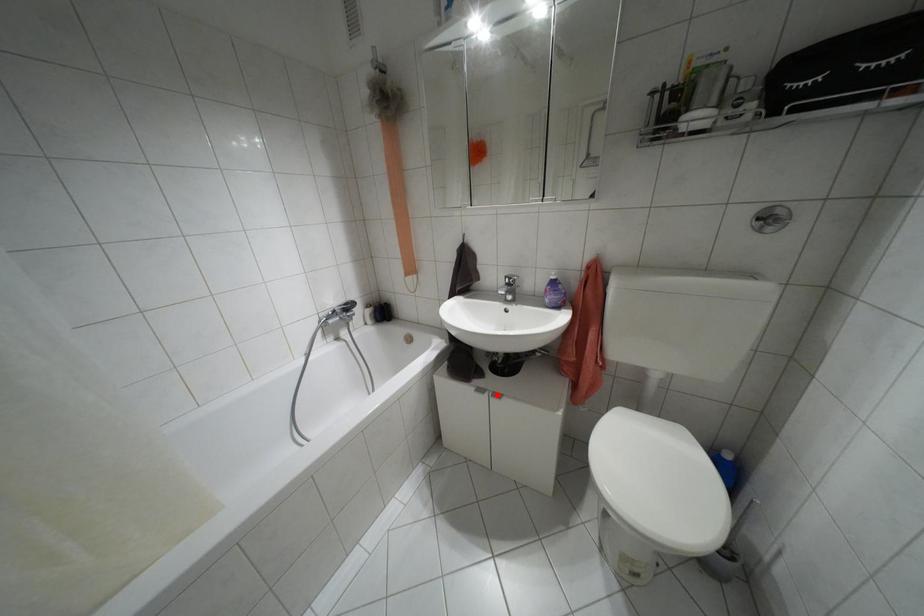
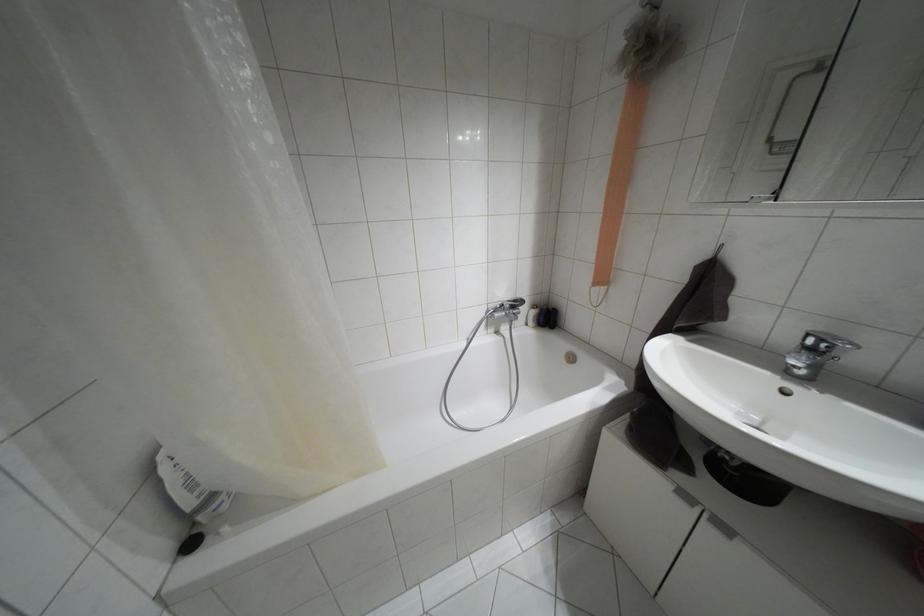
In the second image, find the point that corresponds to the highlighted location in the first image.

(723, 528)